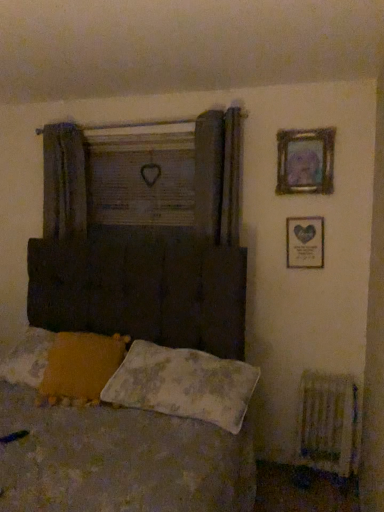
Question: From a real-world perspective, is wooden frame at upper center positioned above or below yellow fabric pillow at lower left, placed as the first pillow when sorted from left to right?

Choices:
 (A) below
 (B) above

Answer: (B)

Question: Considering the positions of point (185, 222) and point (67, 331), is point (185, 222) closer or farther from the camera than point (67, 331)?

Choices:
 (A) farther
 (B) closer

Answer: (A)

Question: Which object is the closest to the white plastic radiator at lower right?

Choices:
 (A) metallic gold picture frame at upper right, the first picture frame when ordered from top to bottom
 (B) fluffy white pillow at lower center, which is the second pillow from left to right
 (C) wooden frame at upper center
 (D) yellow fabric pillow at lower left, placed as the first pillow when sorted from left to right
 (E) textured fabric bed at center

Answer: (B)

Question: Which of these objects is positioned closest to the white plastic radiator at lower right?

Choices:
 (A) metallic gold picture frame at upper right, the first picture frame when ordered from top to bottom
 (B) metallic silver picture frame at upper right, which is counted as the second picture frame, starting from the top
 (C) fluffy white pillow at lower center, which is the second pillow from left to right
 (D) textured fabric bed at center
 (E) yellow fabric pillow at lower left, which is the 2th pillow in right-to-left order

Answer: (C)